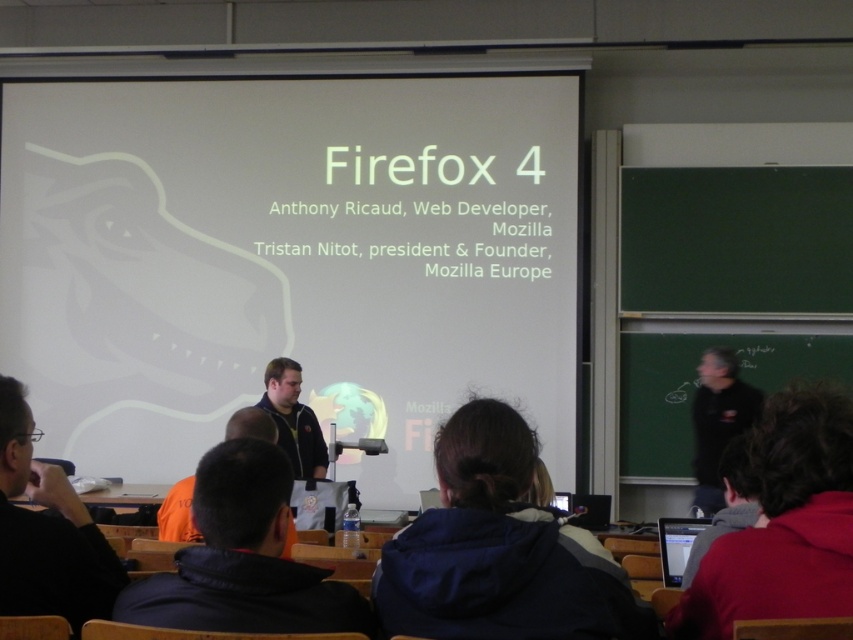
Question: Among these points, which one is farthest from the camera?

Choices:
 (A) (235, 420)
 (B) (234, 88)

Answer: (B)

Question: Which is farther from the dark blue jacket at center?

Choices:
 (A) black matte jacket at lower left
 (B) black matte shirt at right
 (C) dark blue shirt at center

Answer: (A)

Question: Can you confirm if orange fabric jacket at lower center is bigger than dark blue shirt at center?

Choices:
 (A) yes
 (B) no

Answer: (A)

Question: Does orange fabric jacket at lower center appear on the left side of black matte jacket at lower left?

Choices:
 (A) no
 (B) yes

Answer: (A)

Question: Does orange fabric jacket at lower center have a lesser width compared to black matte shirt at right?

Choices:
 (A) yes
 (B) no

Answer: (B)

Question: Which of these objects is positioned farthest from the dark blue jacket at center?

Choices:
 (A) orange fabric jacket at lower center
 (B) dark blue shirt at center
 (C) black matte jacket at lower left

Answer: (A)